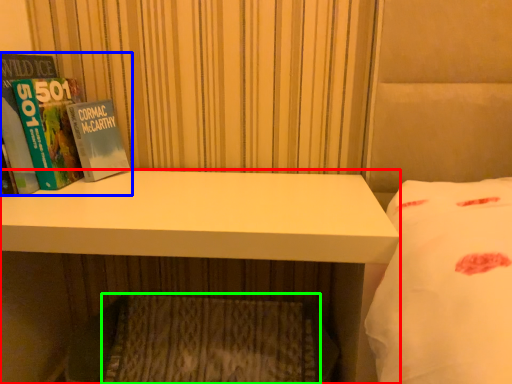
Question: Based on their relative distances, which object is farther from desk (highlighted by a red box)? Choose from book (highlighted by a blue box) and mattress (highlighted by a green box).

Choices:
 (A) book
 (B) mattress

Answer: (B)